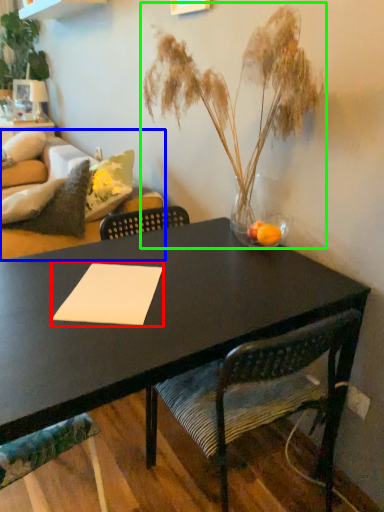
Question: Which object is the closest to the notepad (highlighted by a red box)? Choose among these: couch (highlighted by a blue box) or houseplant (highlighted by a green box).

Choices:
 (A) couch
 (B) houseplant

Answer: (B)